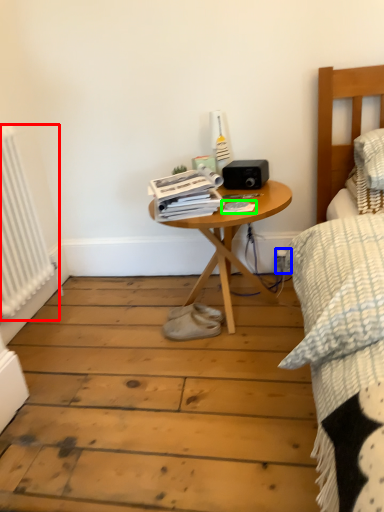
Question: Considering the real-world distances, which object is closest to radiator (highlighted by a red box)? electric outlet (highlighted by a blue box) or magazine (highlighted by a green box).

Choices:
 (A) electric outlet
 (B) magazine

Answer: (B)